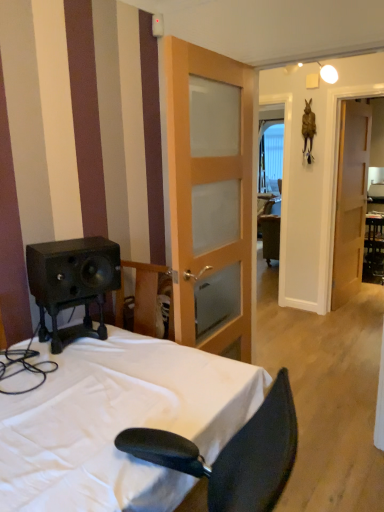
Question: From a real-world perspective, is black glossy table at right on top of light brown wooden door at center, which is the first door from front to back?

Choices:
 (A) no
 (B) yes

Answer: (A)

Question: Is black glossy table at right to the left of light brown wooden door at center, which is the first door from front to back, from the viewer's perspective?

Choices:
 (A) yes
 (B) no

Answer: (B)

Question: Can you confirm if black glossy table at right is bigger than light brown wooden door at center, the first door from the left?

Choices:
 (A) yes
 (B) no

Answer: (B)

Question: Is black glossy table at right surrounding light brown wooden door at center, the first door from the left?

Choices:
 (A) no
 (B) yes

Answer: (A)

Question: From the image's perspective, is black glossy table at right on top of light brown wooden door at center, which is the second door from back to front?

Choices:
 (A) no
 (B) yes

Answer: (B)

Question: Does black glossy table at right come behind light brown wooden door at center, the first door from the left?

Choices:
 (A) no
 (B) yes

Answer: (B)

Question: Does light brown wooden door at center, positioned as the second door in right-to-left order, have a lesser height compared to black glossy table at right?

Choices:
 (A) yes
 (B) no

Answer: (B)

Question: Is the position of light brown wooden door at center, the first door from the left, less distant than that of black glossy table at right?

Choices:
 (A) no
 (B) yes

Answer: (B)

Question: Is black glossy table at right at the back of light brown wooden door at center, the first door from the left?

Choices:
 (A) yes
 (B) no

Answer: (B)

Question: Is light brown wooden door at center, the first door from the left, at the right side of black glossy table at right?

Choices:
 (A) yes
 (B) no

Answer: (B)

Question: Can you confirm if light brown wooden door at center, the first door from the left, is positioned to the left of black glossy table at right?

Choices:
 (A) no
 (B) yes

Answer: (B)

Question: From the image's perspective, does light brown wooden door at center, the first door from the left, appear lower than black glossy table at right?

Choices:
 (A) yes
 (B) no

Answer: (A)

Question: From a real-world perspective, is white fabric bed at lower left located higher than light brown wooden door at center, positioned as the second door in right-to-left order?

Choices:
 (A) yes
 (B) no

Answer: (B)